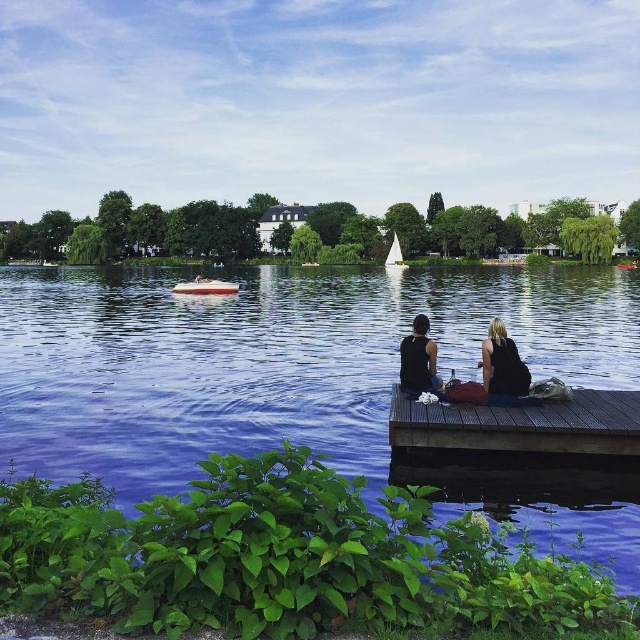
Which is below, blue water at center or brown wooden dock at lower center?

Positioned lower is brown wooden dock at lower center.

Looking at this image, who is more distant from viewer, (202, 332) or (470, 410)?

Point (202, 332)

Identify the location of blue water at center. (307, 380).

From the picture: Does blue water at center have a larger size compared to white plastic boat at center?

Correct, blue water at center is larger in size than white plastic boat at center.

Is blue water at center wider than white plastic boat at center?

Yes, blue water at center is wider than white plastic boat at center.

This screenshot has height=640, width=640. I want to click on blue water at center, so click(x=307, y=380).

Identify the location of blue water at center. The height and width of the screenshot is (640, 640). (307, 380).

Measure the distance between black fabric couple at center and white plastic boat at center.

They are 29.29 meters apart.

Who is lower down, black fabric couple at center or white plastic boat at center?

black fabric couple at center is below.

Locate an element on the screen. black fabric couple at center is located at coordinates (496, 369).